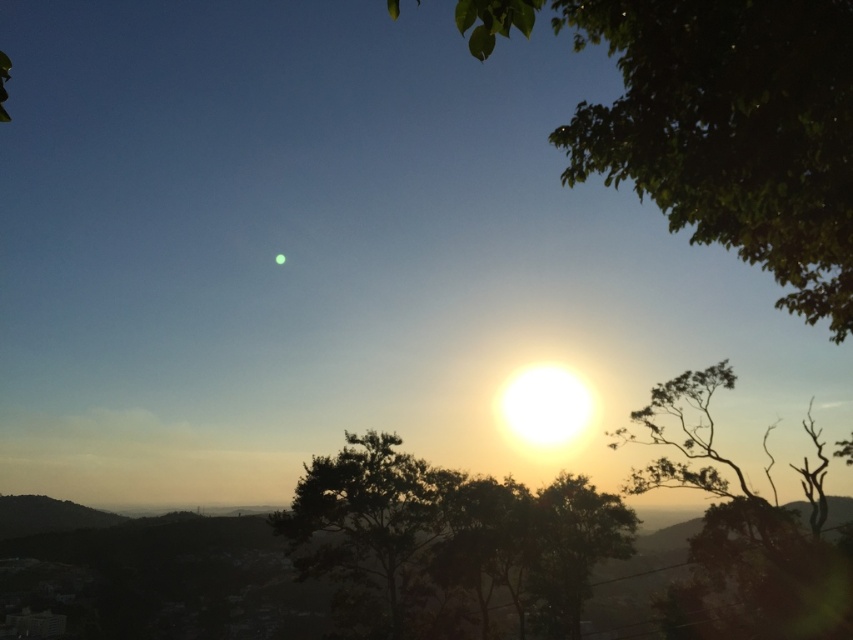
Is green leafy tree at upper right thinner than silhouette/textured tree at center?

No.

Between point (621, 20) and point (405, 477), which one is positioned behind?

Point (405, 477)

Where is `green leafy tree at upper right`? The image size is (853, 640). green leafy tree at upper right is located at coordinates click(730, 131).